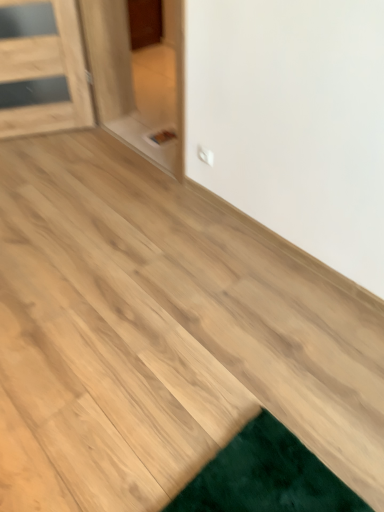
Question: Does natural wood floor at center have a greater height compared to transparent glass door at center?

Choices:
 (A) no
 (B) yes

Answer: (A)

Question: From the image's perspective, is natural wood floor at center located beneath transparent glass door at center?

Choices:
 (A) no
 (B) yes

Answer: (B)

Question: Does natural wood floor at center touch transparent glass door at center?

Choices:
 (A) no
 (B) yes

Answer: (A)

Question: Is natural wood floor at center shorter than transparent glass door at center?

Choices:
 (A) yes
 (B) no

Answer: (A)

Question: Considering the relative sizes of natural wood floor at center and transparent glass door at center in the image provided, is natural wood floor at center wider than transparent glass door at center?

Choices:
 (A) yes
 (B) no

Answer: (A)

Question: Considering the relative sizes of natural wood floor at center and transparent glass door at center in the image provided, is natural wood floor at center bigger than transparent glass door at center?

Choices:
 (A) yes
 (B) no

Answer: (B)

Question: Considering the relative sizes of transparent glass door at center and natural wood floor at center in the image provided, is transparent glass door at center wider than natural wood floor at center?

Choices:
 (A) no
 (B) yes

Answer: (A)

Question: Is transparent glass door at center not near natural wood floor at center?

Choices:
 (A) yes
 (B) no

Answer: (A)

Question: Can you confirm if transparent glass door at center is positioned to the right of natural wood floor at center?

Choices:
 (A) no
 (B) yes

Answer: (B)

Question: Considering the relative sizes of transparent glass door at center and natural wood floor at center in the image provided, is transparent glass door at center bigger than natural wood floor at center?

Choices:
 (A) no
 (B) yes

Answer: (B)

Question: Is transparent glass door at center thinner than natural wood floor at center?

Choices:
 (A) yes
 (B) no

Answer: (A)

Question: Can you confirm if transparent glass door at center is shorter than natural wood floor at center?

Choices:
 (A) yes
 (B) no

Answer: (B)

Question: Is point (148, 87) closer or farther from the camera than point (148, 346)?

Choices:
 (A) closer
 (B) farther

Answer: (B)